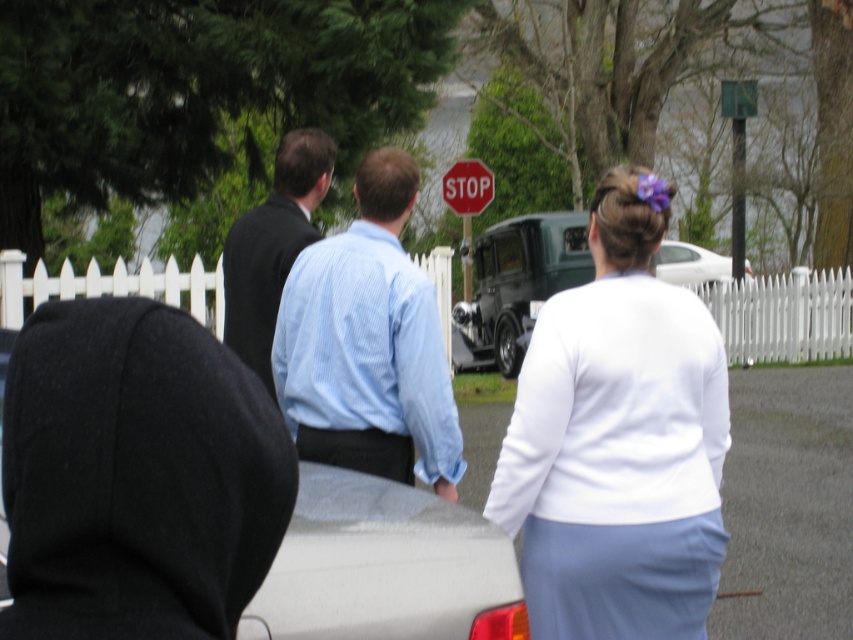
Question: Does black fleece hoodie at center come behind light blue striped shirt at center?

Choices:
 (A) yes
 (B) no

Answer: (B)

Question: Which object is farther from the camera taking this photo?

Choices:
 (A) light blue striped shirt at center
 (B) red plastic stop sign at center
 (C) black fleece hoodie at center
 (D) white matte shirt at center

Answer: (B)

Question: Can you confirm if white matte shirt at center is positioned below green matte pickup truck at center?

Choices:
 (A) yes
 (B) no

Answer: (A)

Question: Which object appears farthest from the camera in this image?

Choices:
 (A) red plastic stop sign at center
 (B) dark suit at center
 (C) black fleece hoodie at center
 (D) light blue striped shirt at center

Answer: (A)

Question: Which point is farther to the camera?

Choices:
 (A) black fleece hoodie at center
 (B) green matte pickup truck at center

Answer: (B)

Question: Is black fleece hoodie at center to the right of green matte pickup truck at center from the viewer's perspective?

Choices:
 (A) no
 (B) yes

Answer: (A)